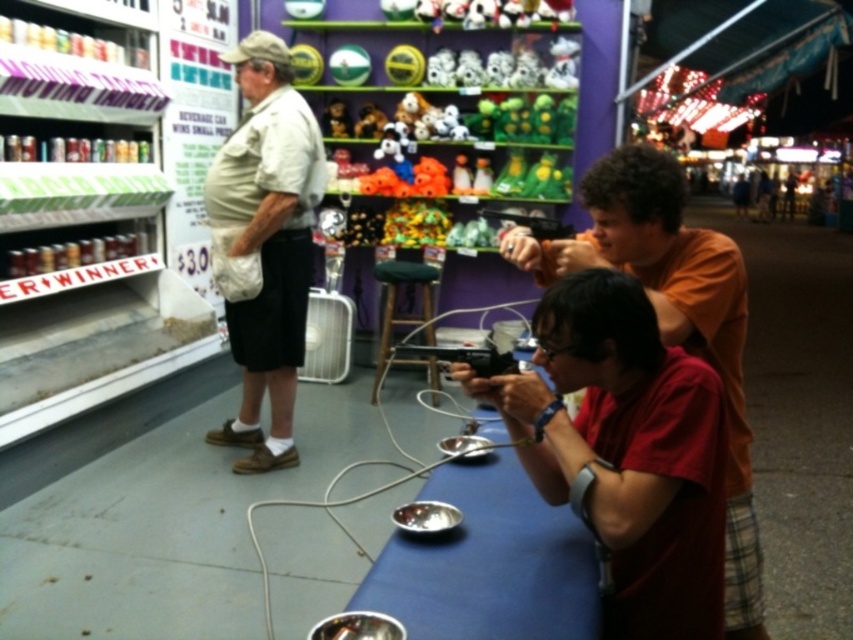
Does khaki cotton shirt at left have a lesser width compared to matte black gun at center?

In fact, khaki cotton shirt at left might be wider than matte black gun at center.

Between khaki cotton shirt at left and matte black gun at center, which one is positioned lower?

khaki cotton shirt at left is lower down.

Locate an element on the screen. khaki cotton shirt at left is located at coordinates (265, 243).

Who is taller, khaki cotton shirt at left or black plastic gun at center?

khaki cotton shirt at left is taller.

Identify the location of khaki cotton shirt at left. (265, 243).

This screenshot has width=853, height=640. I want to click on khaki cotton shirt at left, so click(x=265, y=243).

Can you confirm if orange cotton shirt at center is positioned below black plastic gun at center?

Indeed, orange cotton shirt at center is positioned under black plastic gun at center.

Does orange cotton shirt at center have a larger size compared to black plastic gun at center?

Correct, orange cotton shirt at center is larger in size than black plastic gun at center.

Is point (631, 205) closer to viewer compared to point (511, 372)?

No, (631, 205) is behind (511, 372).

This screenshot has height=640, width=853. Identify the location of orange cotton shirt at center. point(672,317).